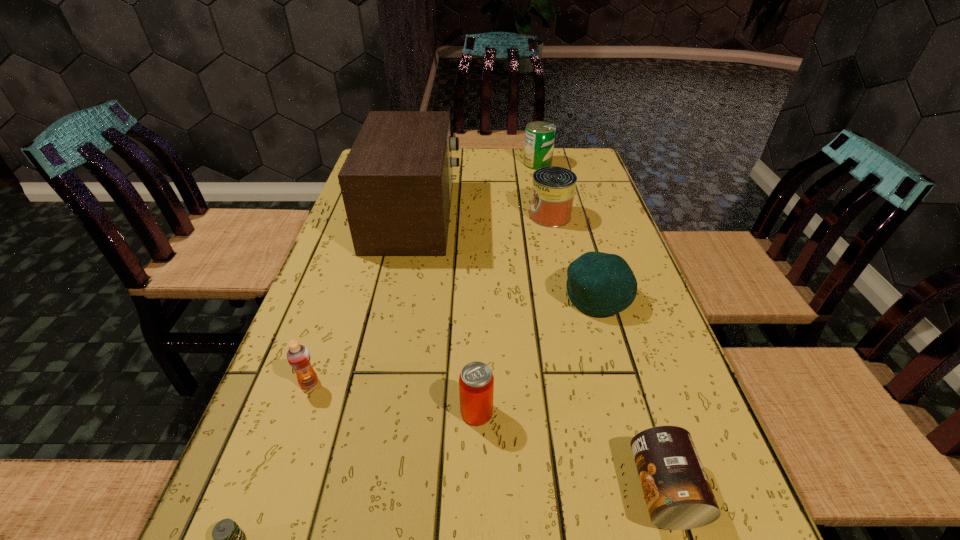
The image size is (960, 540). Identify the location of orange juice situated at the left edge. (298, 356).

Identify the location of beanie at the right edge. This screenshot has height=540, width=960. (599, 284).

Find the location of a particular element. The height and width of the screenshot is (540, 960). object present at the far right corner is located at coordinates (539, 137).

In the image, there is a desktop. At what (x,y) coordinates should I click in order to perform the action: click on vacant region at the far edge. Please return your answer as a coordinate pair (x, y). Looking at the image, I should click on (501, 147).

In the image, there is a desktop. At what (x,y) coordinates should I click in order to perform the action: click on vacant space at the left edge. Please return your answer as a coordinate pair (x, y). The image size is (960, 540). Looking at the image, I should click on (344, 422).

This screenshot has height=540, width=960. I want to click on vacant area at the right edge, so click(x=619, y=353).

The height and width of the screenshot is (540, 960). What are the coordinates of `vacant space at the far right corner of the desktop` in the screenshot? It's located at (588, 163).

The height and width of the screenshot is (540, 960). What are the coordinates of `unoccupied area between the fourth nearest object and the leftmost can` in the screenshot? It's located at (393, 398).

Where is `vacant area between the orange juice and the nearest can`? vacant area between the orange juice and the nearest can is located at coordinates (487, 436).

Locate an element on the screen. The height and width of the screenshot is (540, 960). free space between the orange juice and the third nearest can is located at coordinates (430, 300).